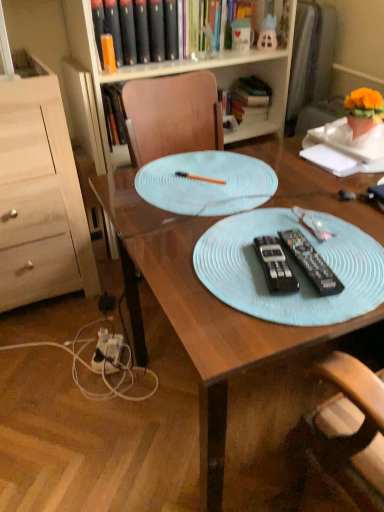
The width and height of the screenshot is (384, 512). I want to click on space that is in front of white paper at upper right, so click(333, 190).